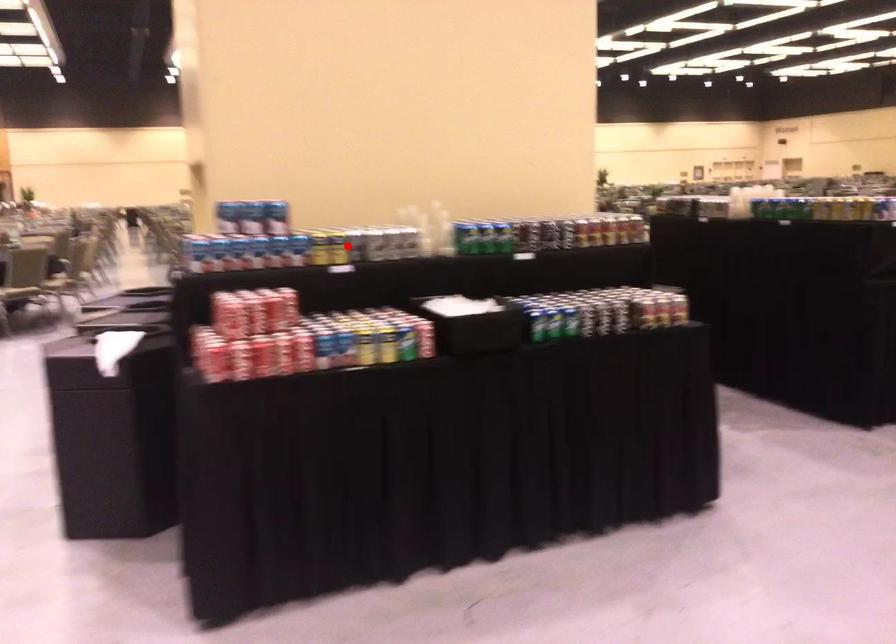
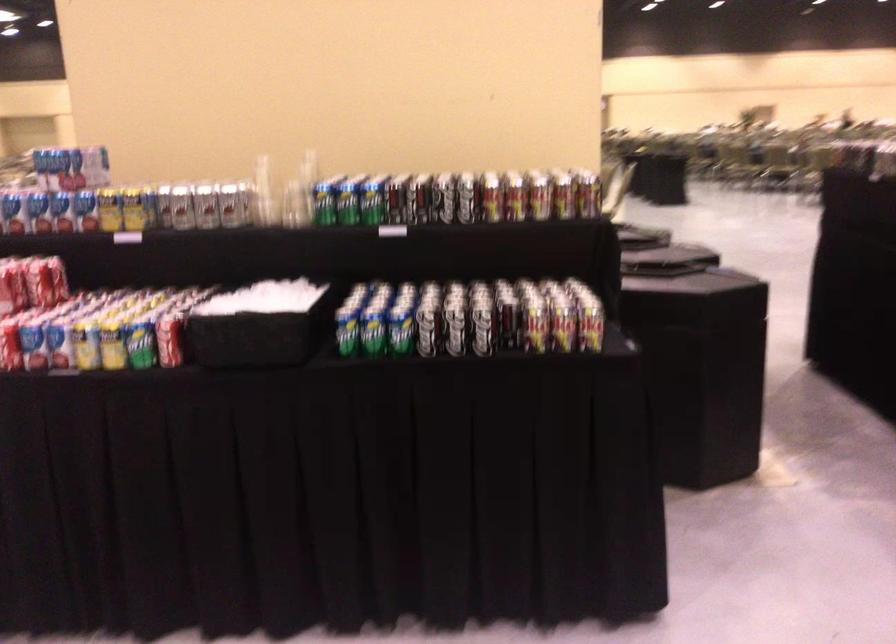
Question: I am providing you with two images of the same scene from different viewpoints. Image1 has a red point marked. In image2, the corresponding 3D location appears at what relative position? Reply with the corresponding letter.

Choices:
 (A) Closer
 (B) Farther

Answer: (A)